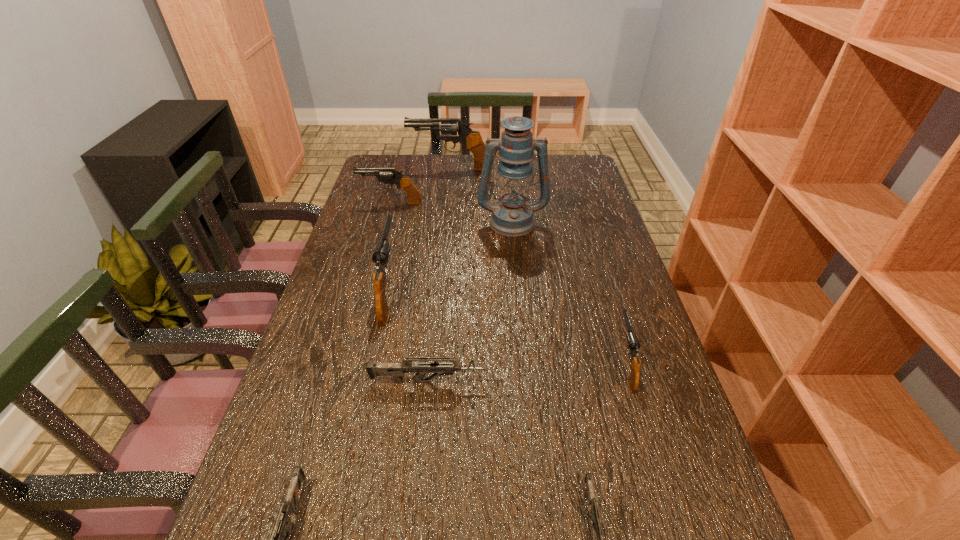
Locate an element on the screen. the second grey gun from left to right is located at coordinates point(396,370).

Locate an element on the screen. The width and height of the screenshot is (960, 540). the third shortest gun is located at coordinates (396, 370).

You are a GUI agent. You are given a task and a screenshot of the screen. Output one action in this format:
    pyautogui.click(x=<x>, y=<y>)
    Task: Click on the free space located 0.170m on the front-facing side of the sixth nearest object
    This screenshot has width=960, height=540.
    Given the screenshot: What is the action you would take?
    pyautogui.click(x=516, y=272)

You are a GUI agent. You are given a task and a screenshot of the screen. Output one action in this format:
    pyautogui.click(x=<x>, y=<y>)
    Task: Click on the vacant space located 0.150m along the barrel of the farthest object
    This screenshot has width=960, height=540.
    Given the screenshot: What is the action you would take?
    pyautogui.click(x=371, y=168)

Identify the location of vacant space located 0.060m along the barrel of the third smallest black gun. (398, 246).

The height and width of the screenshot is (540, 960). In order to click on vacant position located along the barrel of the third smallest black gun in this screenshot , I will do `click(403, 225)`.

Identify the location of vacant point located 0.050m along the barrel of the third smallest black gun. (398, 248).

Locate an element on the screen. Image resolution: width=960 pixels, height=540 pixels. vacant area situated 0.180m along the barrel of the fourth shortest gun is located at coordinates (602, 287).

At what (x,y) coordinates should I click in order to perform the action: click on vacant area situated along the barrel of the fourth shortest gun. Please return your answer as a coordinate pair (x, y). The width and height of the screenshot is (960, 540). Looking at the image, I should click on (594, 259).

Identify the location of vacant space located along the barrel of the fourth shortest gun. The width and height of the screenshot is (960, 540). (605, 294).